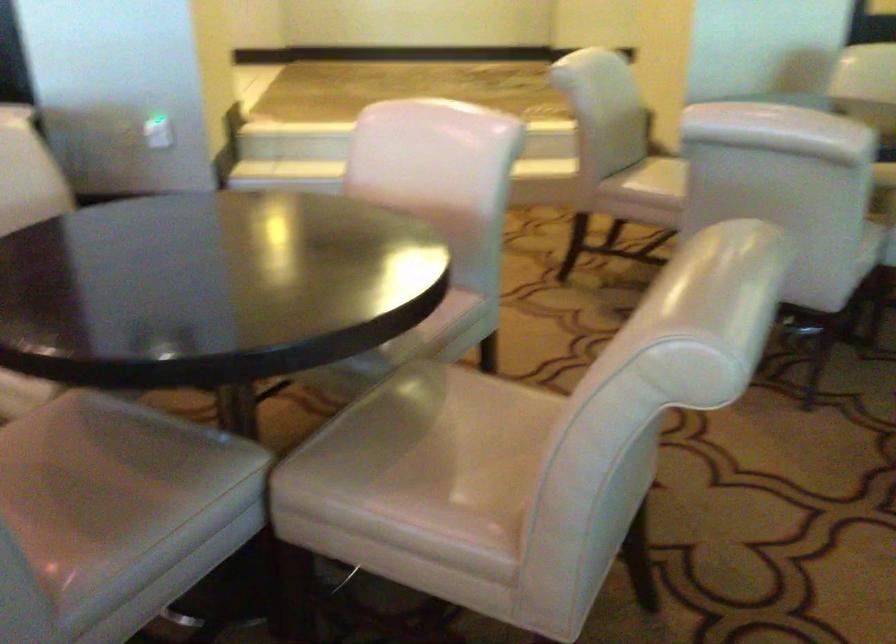
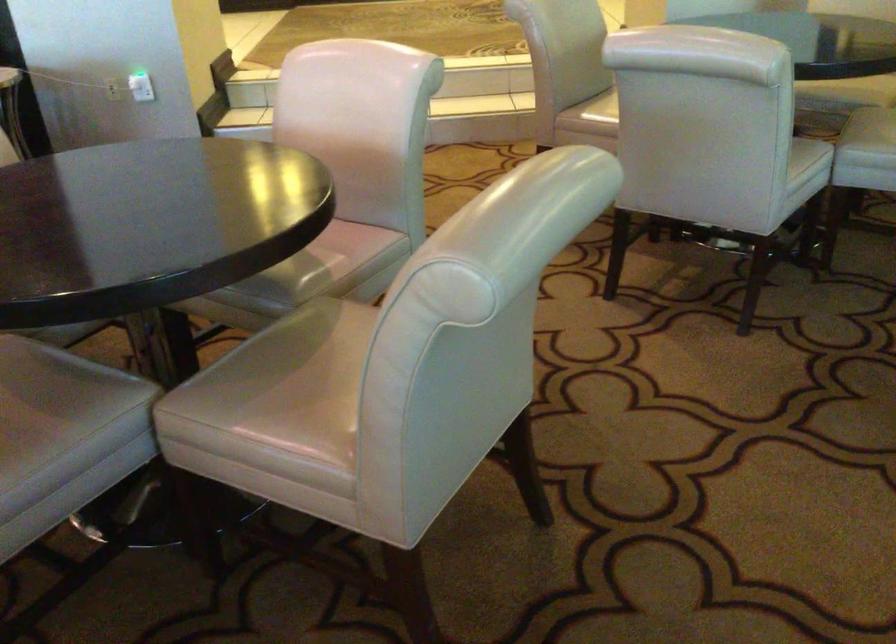
Find the pixel in the second image that matches the point at 435,453 in the first image.

(311, 383)